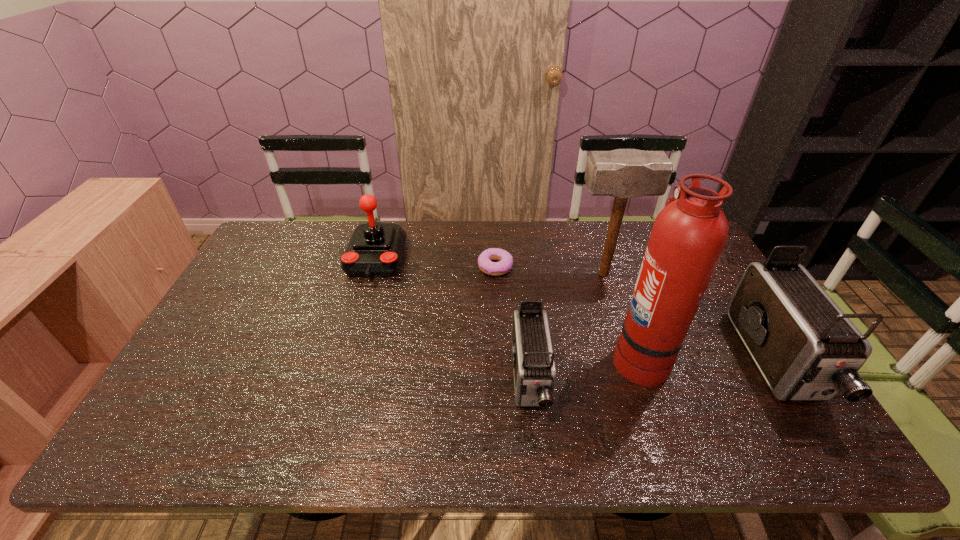
This screenshot has height=540, width=960. I want to click on vacant area that lies between the right camcorder and the tallest object, so click(708, 360).

Locate an element on the screen. Image resolution: width=960 pixels, height=540 pixels. free point between the shortest object and the tallest object is located at coordinates (567, 312).

I want to click on free space between the fire extinguisher and the second shortest object, so click(585, 368).

I want to click on vacant area between the third shortest object and the left camcorder, so click(453, 319).

The image size is (960, 540). Find the location of `free spot between the leftmost object and the rightmost object`. free spot between the leftmost object and the rightmost object is located at coordinates (576, 310).

What are the coordinates of `object that can be found as the third closest to the joystick` in the screenshot? It's located at (622, 173).

Choose which object is the nearest neighbor to the doughnut. Please provide its 2D coordinates. Your answer should be formatted as a tuple, i.e. [(x, y)], where the tuple contains the x and y coordinates of a point satisfying the conditions above.

[(622, 173)]

This screenshot has height=540, width=960. Find the location of `free space in the image that satisfies the following two spatial constraints: 1. on the base of the third shortest object; 2. on the right side of the shortest object`. free space in the image that satisfies the following two spatial constraints: 1. on the base of the third shortest object; 2. on the right side of the shortest object is located at coordinates (373, 267).

Find the location of a particular element. This screenshot has height=540, width=960. free space that satisfies the following two spatial constraints: 1. on the base of the third shortest object; 2. on the right side of the shortest object is located at coordinates (373, 267).

I want to click on free location that satisfies the following two spatial constraints: 1. on the striking face of the mallet; 2. at the lens of the second shortest object, so click(637, 380).